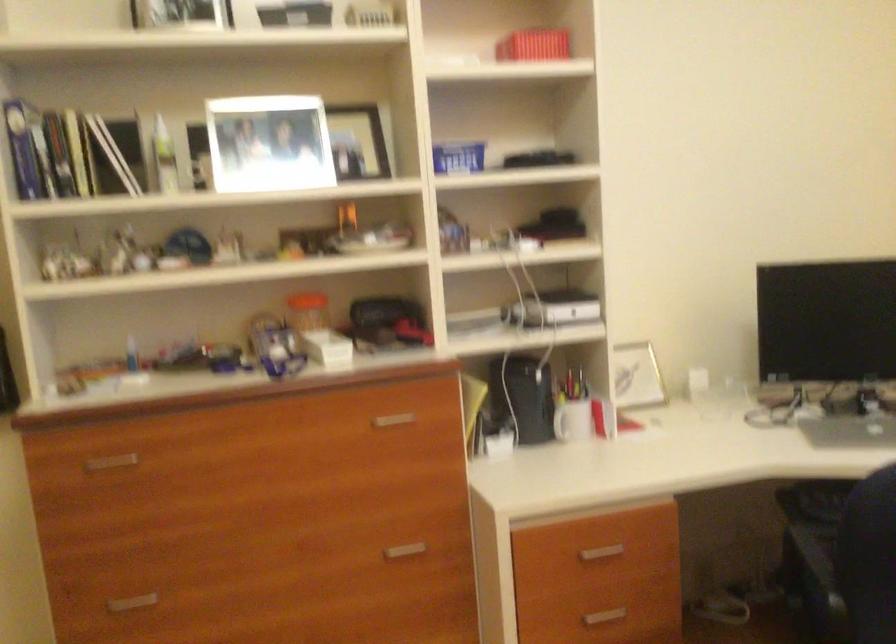
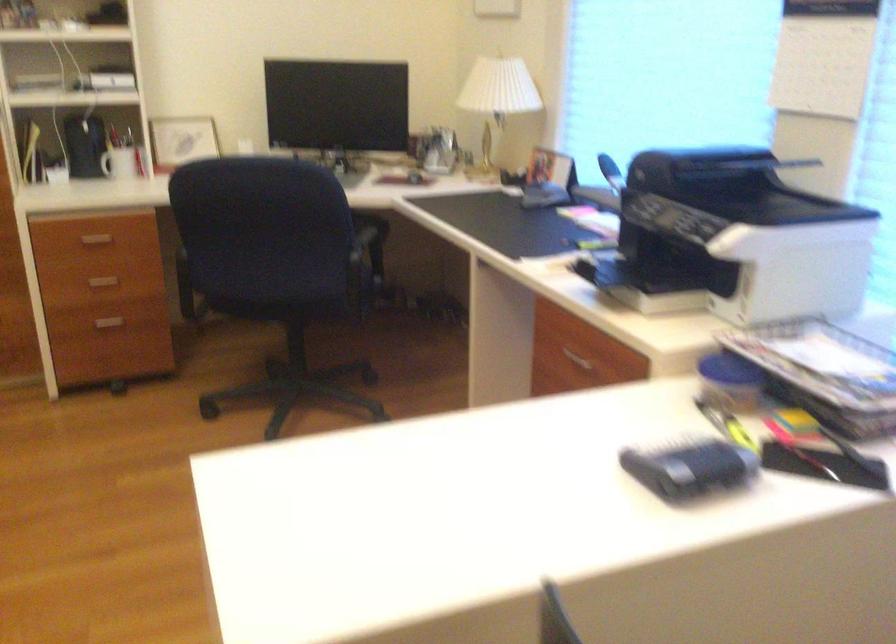
In a continuous first-person perspective shot, in which direction is the camera moving?

The cameraman moved toward right, backward.